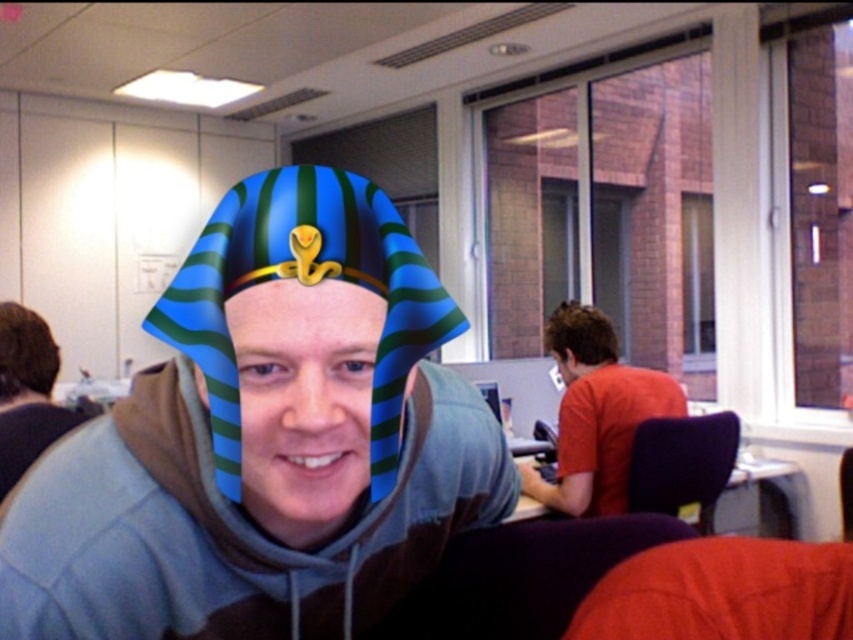
You are an office security guard who notices two features in the image. One is the blue striped cloth headdress at center and the other is the brown hair at right. Which one is closer to the camera?

The blue striped cloth headdress at center is closer to the camera because it is in front of the brown hair at right.

You are standing in the office and want to reach both the point at coordinates (x=340, y=220) and the point at (x=4, y=378). Which point will you reach first if you move directly towards them?

You will reach the point at coordinates (x=340, y=220) first because it is closer to you than the point at (x=4, y=378).

In the office scene, there is a blue striped cloth headdress at center and a brown hair at left. Which object is wider?

The blue striped cloth headdress at center might be wider than brown hair at left.